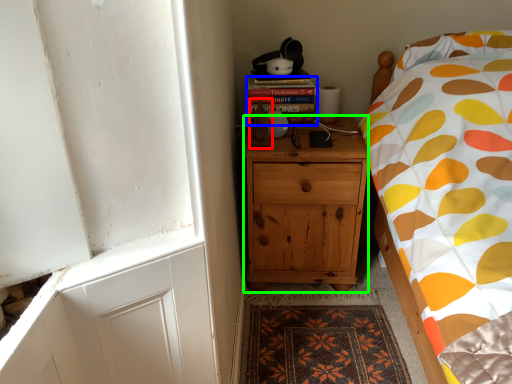
Question: Estimate the real-world distances between objects in this image. Which object is closer to toy (highlighted by a red box), book (highlighted by a blue box) or cabinetry (highlighted by a green box)?

Choices:
 (A) book
 (B) cabinetry

Answer: (A)